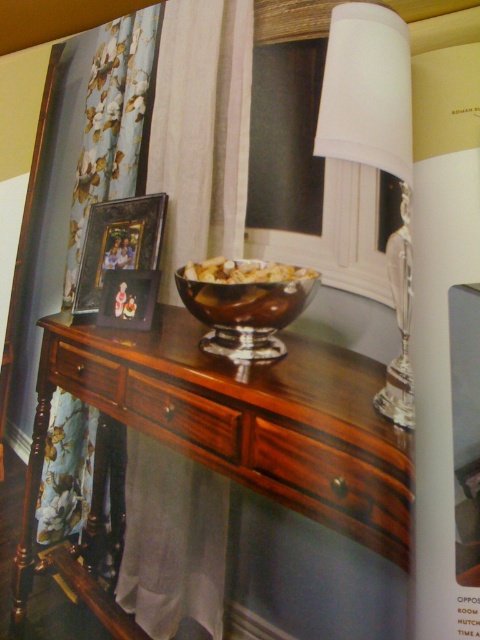
Which is more to the right, mahogany wood dresser at center or mahogany wood drawer at center?

Positioned to the right is mahogany wood drawer at center.

Measure the distance from mahogany wood dresser at center to mahogany wood drawer at center.

3.06 inches

You are a GUI agent. You are given a task and a screenshot of the screen. Output one action in this format:
    pyautogui.click(x=<x>, y=<y>)
    Task: Click on the mahogany wood dresser at center
    
    Given the screenshot: What is the action you would take?
    pyautogui.click(x=245, y=428)

The height and width of the screenshot is (640, 480). Describe the element at coordinates (244, 304) in the screenshot. I see `shiny brown glass bowl at center` at that location.

Between point (214, 260) and point (55, 365), which one is positioned in front?

Point (214, 260) is more forward.

What are the coordinates of `shiny brown glass bowl at center` in the screenshot? It's located at (244, 304).

Between mahogany wood dresser at center and shiny brown glass bowl at center, which one has more height?

mahogany wood dresser at center is taller.

Does mahogany wood dresser at center appear under shiny brown glass bowl at center?

Correct, mahogany wood dresser at center is located below shiny brown glass bowl at center.

Where is `mahogany wood dresser at center`? This screenshot has width=480, height=640. mahogany wood dresser at center is located at coordinates (245, 428).